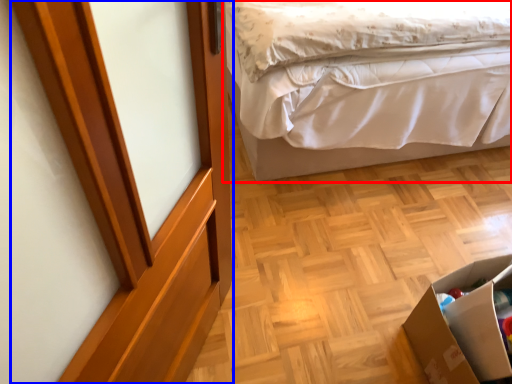
Question: Which point is further to the camera, bed (highlighted by a red box) or screen door (highlighted by a blue box)?

Choices:
 (A) bed
 (B) screen door

Answer: (A)